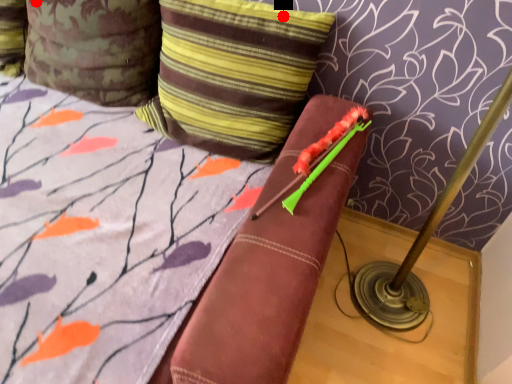
Question: Two points are circled on the image, labeled by A and B beside each circle. Among these points, which one is nearest to the camera?

Choices:
 (A) A is closer
 (B) B is closer

Answer: (A)